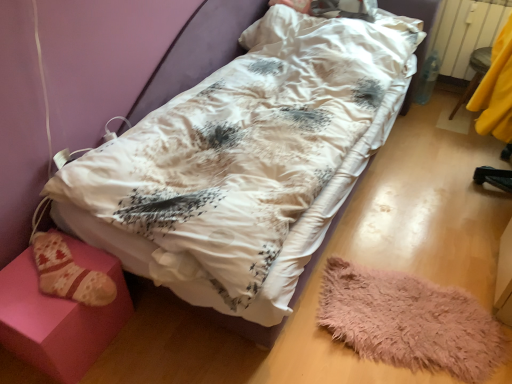
Question: From the image's perspective, is fluffy pink mat at lower right above white satin hospital bed at center?

Choices:
 (A) yes
 (B) no

Answer: (B)

Question: Can you confirm if fluffy pink mat at lower right is thinner than white satin hospital bed at center?

Choices:
 (A) yes
 (B) no

Answer: (A)

Question: Is fluffy pink mat at lower right located outside white satin hospital bed at center?

Choices:
 (A) yes
 (B) no

Answer: (A)

Question: Is fluffy pink mat at lower right with white satin hospital bed at center?

Choices:
 (A) no
 (B) yes

Answer: (A)

Question: Is fluffy pink mat at lower right to the left of white satin hospital bed at center from the viewer's perspective?

Choices:
 (A) yes
 (B) no

Answer: (B)

Question: Is fluffy pink mat at lower right smaller than white satin hospital bed at center?

Choices:
 (A) no
 (B) yes

Answer: (B)

Question: Is pink fabric stool at lower left, which appears as the first furniture when viewed from the left, closer to the viewer compared to yellow fabric at right, the 2th furniture when ordered from bottom to top?

Choices:
 (A) yes
 (B) no

Answer: (A)

Question: Is pink fabric stool at lower left, the second furniture viewed from the top, next to yellow fabric at right, which is the 1th furniture in right-to-left order, and touching it?

Choices:
 (A) yes
 (B) no

Answer: (B)

Question: Could you tell me if pink fabric stool at lower left, the second furniture viewed from the top, is facing yellow fabric at right, placed as the 2th furniture when sorted from left to right?

Choices:
 (A) yes
 (B) no

Answer: (B)

Question: From a real-world perspective, is pink fabric stool at lower left, which is the 2th furniture in back-to-front order, below yellow fabric at right, arranged as the second furniture when viewed from the front?

Choices:
 (A) no
 (B) yes

Answer: (B)

Question: Can you confirm if pink fabric stool at lower left, the second furniture viewed from the top, is bigger than yellow fabric at right, placed as the 2th furniture when sorted from left to right?

Choices:
 (A) yes
 (B) no

Answer: (B)

Question: Can you confirm if pink fabric stool at lower left, the second furniture viewed from the top, is shorter than yellow fabric at right, arranged as the second furniture when viewed from the front?

Choices:
 (A) no
 (B) yes

Answer: (B)

Question: Is white satin hospital bed at center in front of white plastic radiator at upper right?

Choices:
 (A) no
 (B) yes

Answer: (B)